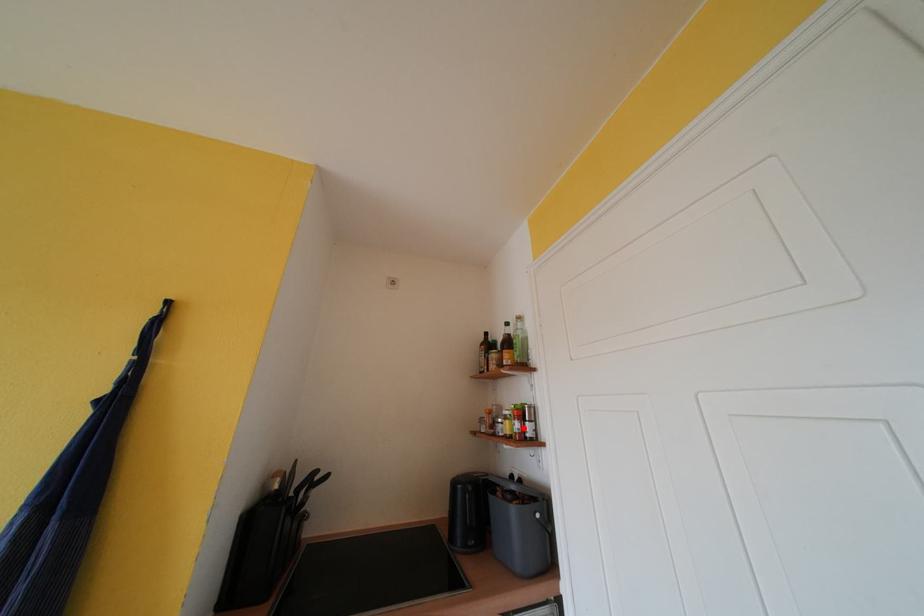
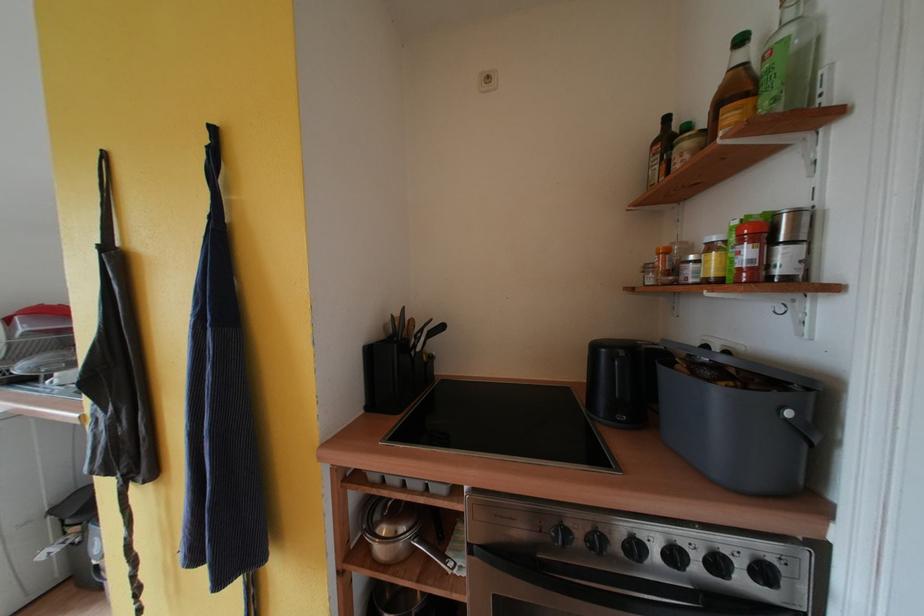
Where in the second image is the point corresponding to the highlighted location from the first image?

(755, 256)